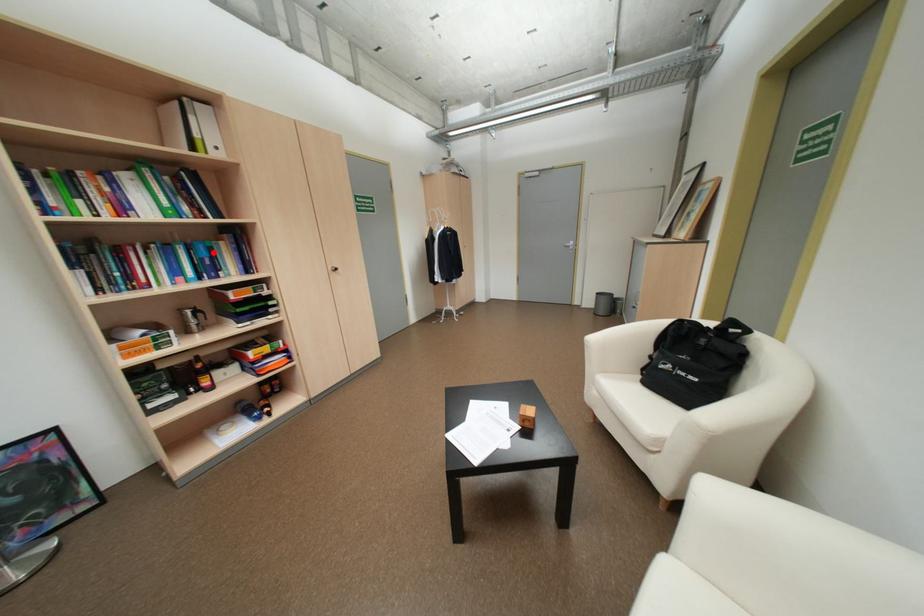
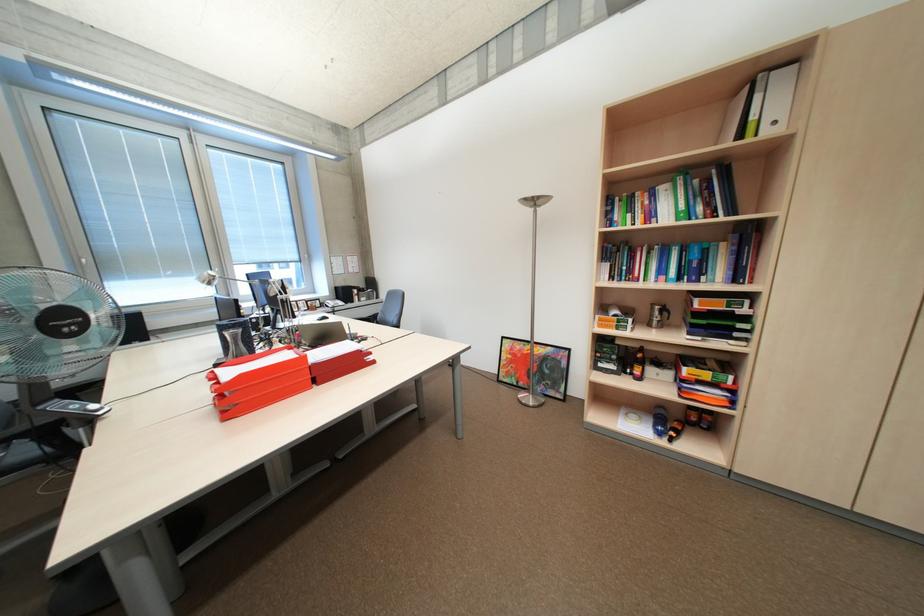
Find the pixel in the second image that matches the highlighted location in the first image.

(704, 254)